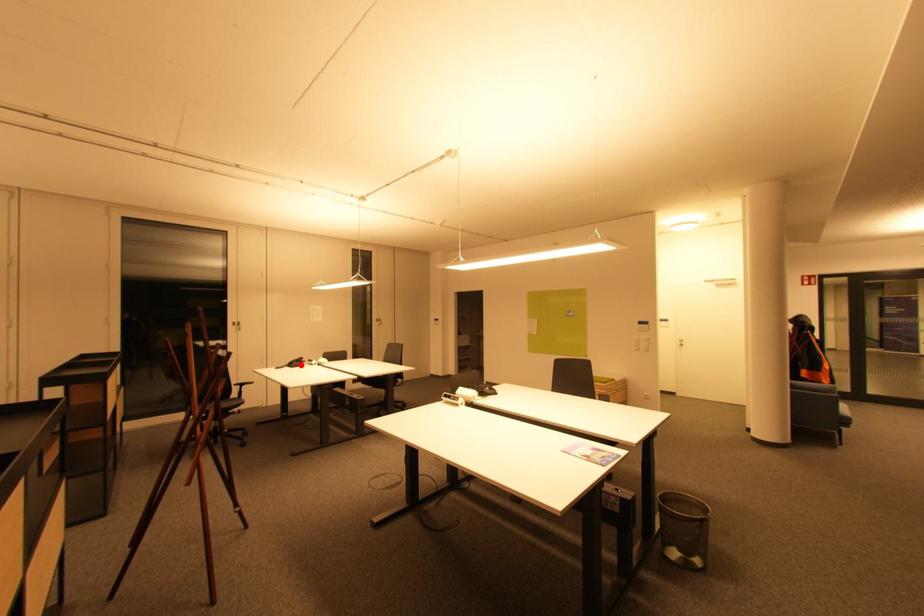
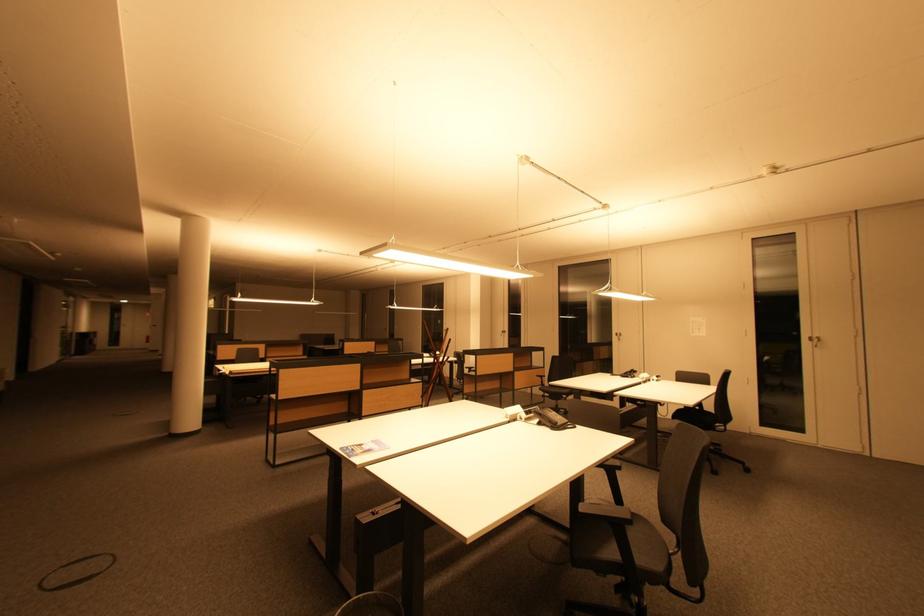
Find the pixel in the second image that matches the highlighted location in the first image.

(635, 376)